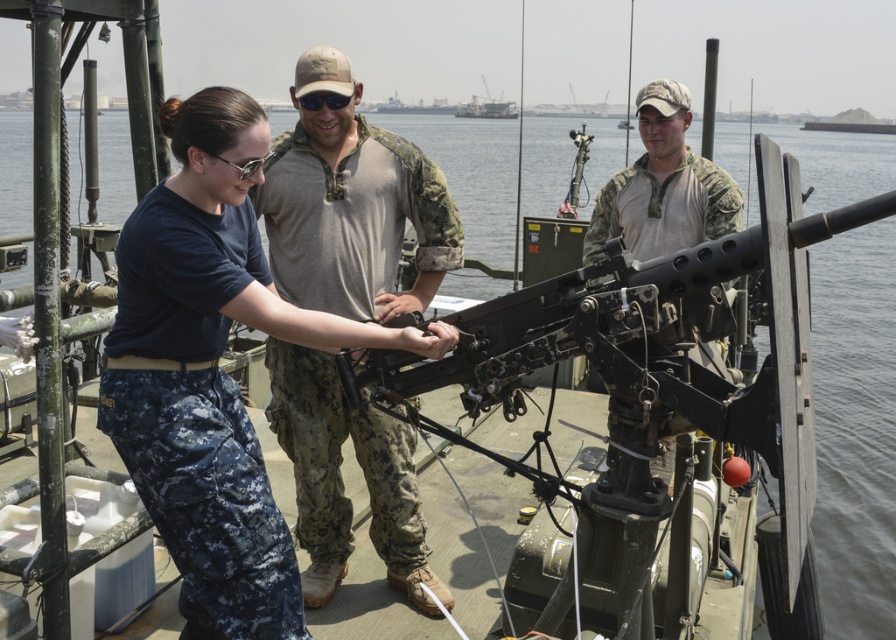
Question: Among these objects, which one is farthest from the camera?

Choices:
 (A) blue camouflage pants at center
 (B) metallic gray ship at upper center

Answer: (B)

Question: Which of the following is the closest to the observer?

Choices:
 (A) blue camouflage pants at center
 (B) metallic gray ship at upper center

Answer: (A)

Question: From the image, what is the correct spatial relationship of blue camouflage pants at center in relation to metallic gray ship at upper center?

Choices:
 (A) below
 (B) above

Answer: (A)

Question: Does blue camouflage pants at center have a smaller size compared to metallic gray ship at upper center?

Choices:
 (A) yes
 (B) no

Answer: (A)

Question: Observing the image, what is the correct spatial positioning of blue camouflage pants at center in reference to metallic gray ship at upper center?

Choices:
 (A) left
 (B) right

Answer: (A)